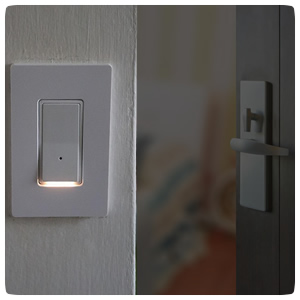
Find the location of a particular element. This screenshot has width=300, height=300. door lock is located at coordinates (248, 123).